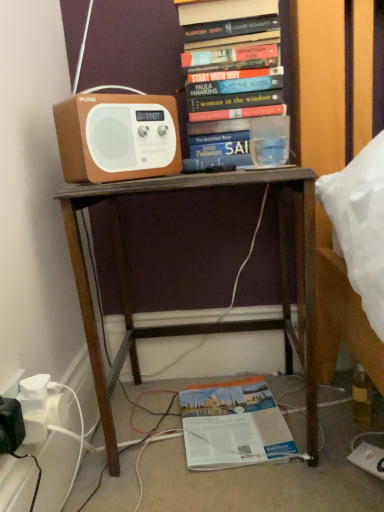
Question: Which direction should I rotate to face hardcover books at upper center, positioned as the 1th book in top-to-bottom order, — up or down?

Choices:
 (A) down
 (B) up

Answer: (B)

Question: Is hardcover books at upper center, placed as the second book when sorted from bottom to top, facing away from orange paper book at lower center, which appears as the 1th book when ordered from the bottom?

Choices:
 (A) no
 (B) yes

Answer: (A)

Question: Does hardcover books at upper center, placed as the second book when sorted from bottom to top, have a lesser width compared to orange paper book at lower center, which appears as the 1th book when ordered from the bottom?

Choices:
 (A) no
 (B) yes

Answer: (B)

Question: Is hardcover books at upper center, positioned as the 1th book in top-to-bottom order, outside of orange paper book at lower center, the 2th book from the top?

Choices:
 (A) no
 (B) yes

Answer: (B)

Question: Is hardcover books at upper center, positioned as the 1th book in top-to-bottom order, shorter than orange paper book at lower center, which appears as the 1th book when ordered from the bottom?

Choices:
 (A) no
 (B) yes

Answer: (A)

Question: From a real-world perspective, is hardcover books at upper center, positioned as the 1th book in top-to-bottom order, under orange paper book at lower center, the 2th book from the top?

Choices:
 (A) yes
 (B) no

Answer: (B)

Question: From the image's perspective, is hardcover books at upper center, positioned as the 1th book in top-to-bottom order, beneath orange paper book at lower center, which appears as the 1th book when ordered from the bottom?

Choices:
 (A) yes
 (B) no

Answer: (B)

Question: Is brown wooden desk at center smaller than orange paper book at lower center, which appears as the 1th book when ordered from the bottom?

Choices:
 (A) yes
 (B) no

Answer: (B)

Question: Does brown wooden desk at center have a greater width compared to orange paper book at lower center, the 2th book from the top?

Choices:
 (A) no
 (B) yes

Answer: (B)

Question: Does brown wooden desk at center come in front of orange paper book at lower center, the 2th book from the top?

Choices:
 (A) yes
 (B) no

Answer: (A)

Question: From a real-world perspective, is brown wooden desk at center physically below orange paper book at lower center, the 2th book from the top?

Choices:
 (A) yes
 (B) no

Answer: (B)

Question: Are brown wooden desk at center and orange paper book at lower center, which appears as the 1th book when ordered from the bottom, located far from each other?

Choices:
 (A) yes
 (B) no

Answer: (B)

Question: Considering the relative sizes of brown wooden desk at center and orange paper book at lower center, the 2th book from the top, in the image provided, is brown wooden desk at center shorter than orange paper book at lower center, the 2th book from the top,?

Choices:
 (A) no
 (B) yes

Answer: (A)

Question: Considering the relative sizes of brown matte speaker at upper left and orange paper book at lower center, the 2th book from the top, in the image provided, is brown matte speaker at upper left thinner than orange paper book at lower center, the 2th book from the top,?

Choices:
 (A) no
 (B) yes

Answer: (B)